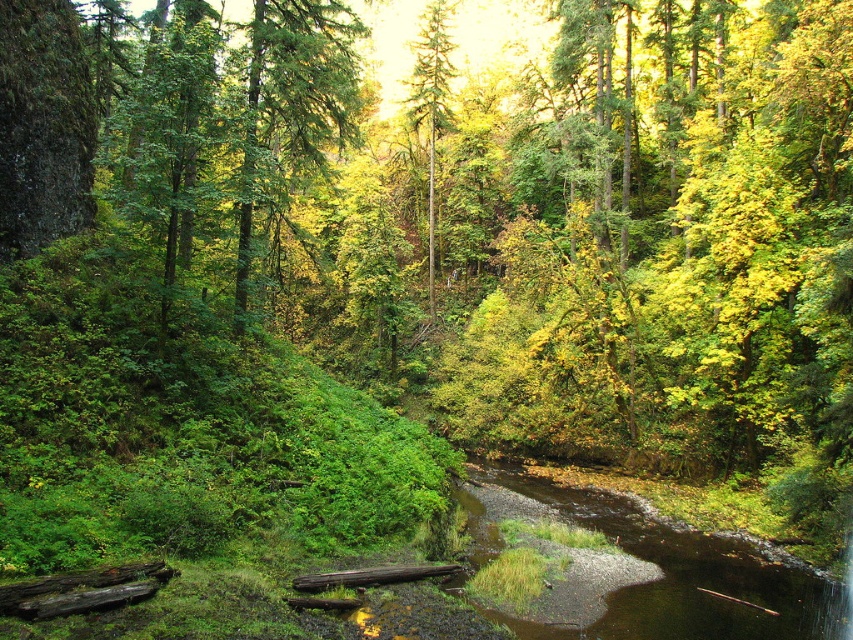
Which of these two, brown gravel river at center or green matte tree at center, stands taller?

green matte tree at center

Can you confirm if brown gravel river at center is positioned to the right of green matte tree at center?

Correct, you'll find brown gravel river at center to the right of green matte tree at center.

Who is more forward, (643,552) or (442,60)?

Positioned in front is point (643,552).

Identify the location of brown gravel river at center. (679, 577).